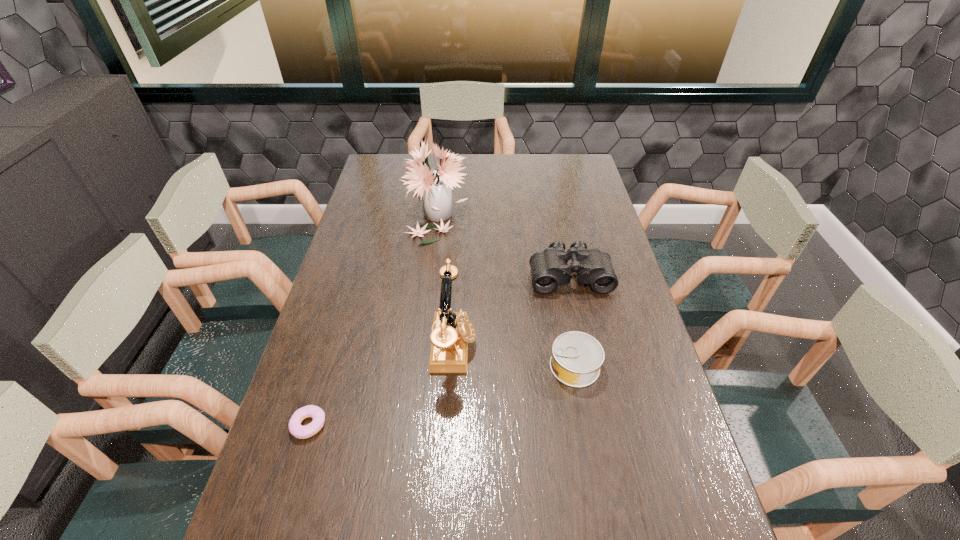
I want to click on the third closest object to the second shortest object, so click(x=435, y=187).

Where is `vacant space that satisfies the following two spatial constraints: 1. on the dial of the second tallest object; 2. on the back side of the can`? This screenshot has height=540, width=960. vacant space that satisfies the following two spatial constraints: 1. on the dial of the second tallest object; 2. on the back side of the can is located at coordinates (452, 366).

You are a GUI agent. You are given a task and a screenshot of the screen. Output one action in this format:
    pyautogui.click(x=<x>, y=<y>)
    Task: Click on the free location that satisfies the following two spatial constraints: 1. at the eyepieces of the third shortest object; 2. on the dial of the second tallest object
    This screenshot has width=960, height=540.
    Given the screenshot: What is the action you would take?
    pyautogui.click(x=585, y=346)

At what (x,y) coordinates should I click in order to perform the action: click on free space that satisfies the following two spatial constraints: 1. on the dial of the can; 2. on the left side of the telephone. Please return your answer as a coordinate pair (x, y). This screenshot has width=960, height=540. Looking at the image, I should click on (452, 366).

The width and height of the screenshot is (960, 540). In order to click on free point that satisfies the following two spatial constraints: 1. on the dial of the second tallest object; 2. on the left side of the second shortest object in this screenshot , I will do `click(452, 366)`.

Locate an element on the screen. free spot that satisfies the following two spatial constraints: 1. on the dial of the telephone; 2. on the left side of the fourth tallest object is located at coordinates (452, 366).

Identify the location of free space that satisfies the following two spatial constraints: 1. on the back side of the second shortest object; 2. on the dial of the fourth shortest object. (570, 346).